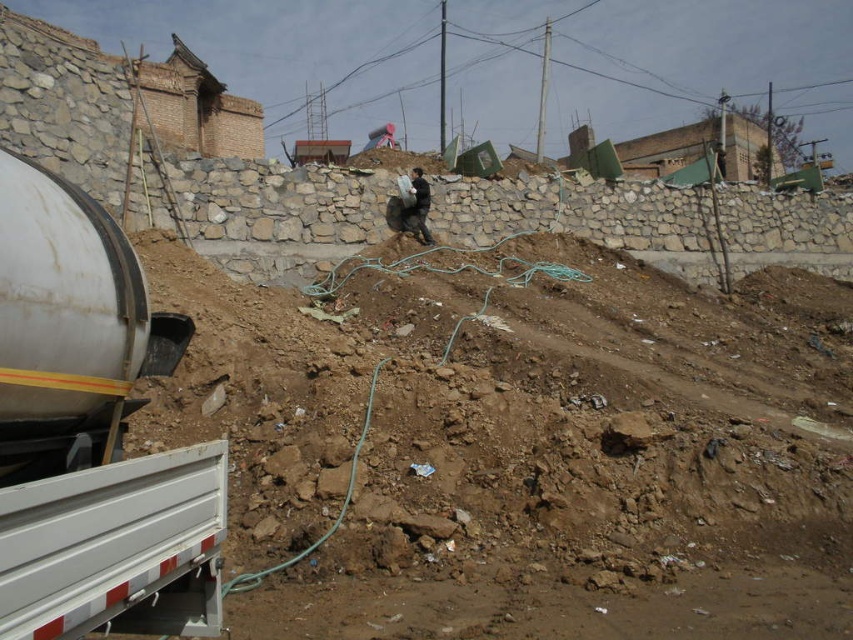
Question: Which of these objects is positioned closest to the dark gray fabric bag at upper center?

Choices:
 (A) brown dirt at center
 (B) white metallic trailer truck at lower left
 (C) white matte trailer truck at lower left

Answer: (A)

Question: Which point appears farthest from the camera in this image?

Choices:
 (A) (114, 547)
 (B) (405, 193)

Answer: (B)

Question: Is white matte trailer truck at lower left positioned behind white metallic trailer truck at lower left?

Choices:
 (A) no
 (B) yes

Answer: (B)

Question: Is brown dirt at center above white metallic trailer truck at lower left?

Choices:
 (A) yes
 (B) no

Answer: (A)

Question: Which point is farther to the camera?

Choices:
 (A) (68, 548)
 (B) (144, 570)
 (C) (451, 436)

Answer: (C)

Question: Observing the image, what is the correct spatial positioning of white metallic trailer truck at lower left in reference to dark gray fabric bag at upper center?

Choices:
 (A) above
 (B) below

Answer: (B)